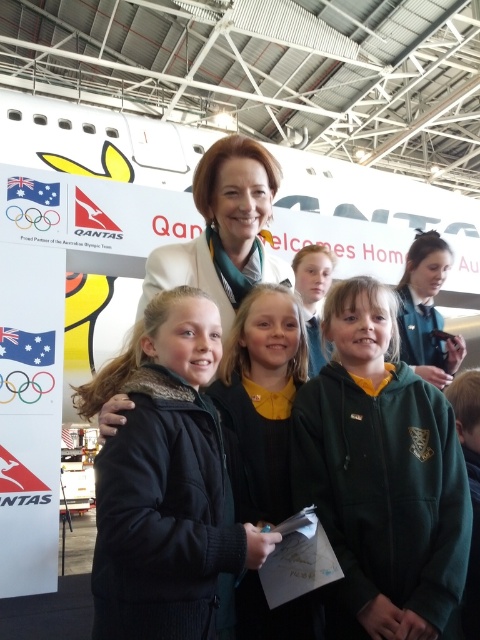
Question: Which of these objects is positioned closest to the black fuzzy jacket at center?

Choices:
 (A) green fabric jacket at upper right
 (B) green fleece jacket at center
 (C) green fleece jacket at lower right

Answer: (B)

Question: Which is farther from the black fuzzy jacket at center?

Choices:
 (A) smooth yellow hair at center
 (B) green fleece jacket at lower right
 (C) green fabric jacket at upper right
 (D) black woolen sweater at center

Answer: (C)

Question: Which object appears closest to the camera in this image?

Choices:
 (A) green fleece jacket at center
 (B) green fabric jacket at upper right
 (C) black fuzzy jacket at center

Answer: (C)

Question: Is black fuzzy jacket at center further to camera compared to green fleece jacket at lower right?

Choices:
 (A) yes
 (B) no

Answer: (B)

Question: Does green fabric jacket at upper right appear over smooth yellow hair at center?

Choices:
 (A) no
 (B) yes

Answer: (A)

Question: Does green fabric jacket at upper right lie in front of smooth yellow hair at center?

Choices:
 (A) no
 (B) yes

Answer: (B)